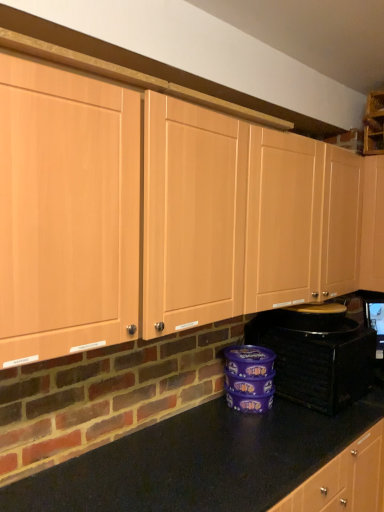
Question: Is black plastic toaster at lower right taller or shorter than matte wood cabinets at center?

Choices:
 (A) short
 (B) tall

Answer: (A)

Question: From the image's perspective, relative to matte wood cabinets at center, is black plastic toaster at lower right above or below?

Choices:
 (A) above
 (B) below

Answer: (B)

Question: Is point (339, 332) positioned closer to the camera than point (33, 258)?

Choices:
 (A) closer
 (B) farther

Answer: (B)

Question: From the image's perspective, is matte wood cabinets at center positioned above or below black plastic toaster at lower right?

Choices:
 (A) above
 (B) below

Answer: (A)

Question: Considering the positions of matte wood cabinets at center and black plastic toaster at lower right in the image, is matte wood cabinets at center taller or shorter than black plastic toaster at lower right?

Choices:
 (A) short
 (B) tall

Answer: (B)

Question: Do you think matte wood cabinets at center is within black plastic toaster at lower right, or outside of it?

Choices:
 (A) outside
 (B) inside

Answer: (A)

Question: Considering the relative positions of matte wood cabinets at center and black plastic toaster at lower right in the image provided, is matte wood cabinets at center to the left or to the right of black plastic toaster at lower right?

Choices:
 (A) right
 (B) left

Answer: (B)